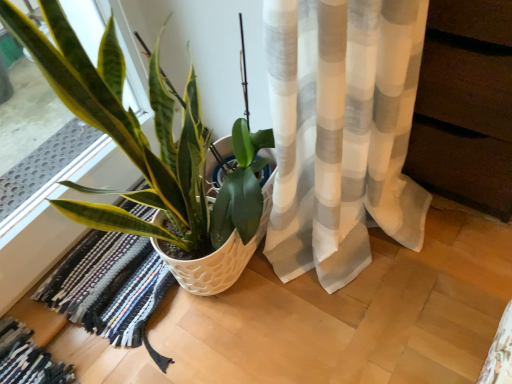
Question: From the image's perspective, is rug with frayed edges at lower left on top of white textured pot at lower left?

Choices:
 (A) yes
 (B) no

Answer: (B)

Question: From a real-world perspective, is rug with frayed edges at lower left physically above white textured pot at lower left?

Choices:
 (A) yes
 (B) no

Answer: (B)

Question: Considering the relative sizes of rug with frayed edges at lower left and white textured pot at lower left in the image provided, is rug with frayed edges at lower left bigger than white textured pot at lower left?

Choices:
 (A) no
 (B) yes

Answer: (A)

Question: Does rug with frayed edges at lower left appear on the left side of white textured pot at lower left?

Choices:
 (A) yes
 (B) no

Answer: (A)

Question: Can you confirm if rug with frayed edges at lower left is positioned to the right of white textured pot at lower left?

Choices:
 (A) no
 (B) yes

Answer: (A)

Question: Is rug with frayed edges at lower left oriented away from white textured pot at lower left?

Choices:
 (A) yes
 (B) no

Answer: (A)

Question: Is white textured pot at lower left behind rug with frayed edges at lower left?

Choices:
 (A) yes
 (B) no

Answer: (B)

Question: Does white textured pot at lower left have a lesser width compared to rug with frayed edges at lower left?

Choices:
 (A) yes
 (B) no

Answer: (A)

Question: Does white textured pot at lower left have a smaller size compared to rug with frayed edges at lower left?

Choices:
 (A) no
 (B) yes

Answer: (A)

Question: Would you say white textured pot at lower left is a long distance from rug with frayed edges at lower left?

Choices:
 (A) no
 (B) yes

Answer: (A)

Question: From the image's perspective, would you say white textured pot at lower left is shown under rug with frayed edges at lower left?

Choices:
 (A) no
 (B) yes

Answer: (A)

Question: Is white textured pot at lower left to the right of rug with frayed edges at lower left from the viewer's perspective?

Choices:
 (A) no
 (B) yes

Answer: (B)

Question: Is white textured pot at lower left in front of or behind rug with frayed edges at lower left in the image?

Choices:
 (A) behind
 (B) front

Answer: (B)